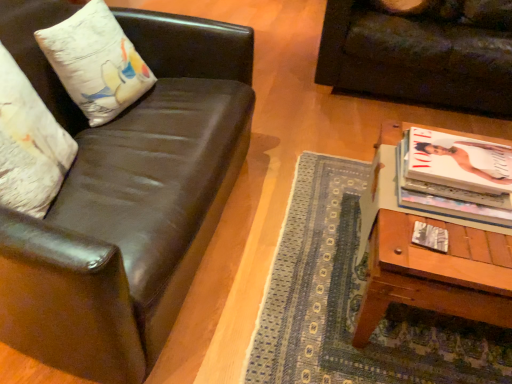
What are the coordinates of `vacant area to the right of matte white magazine at right` in the screenshot? It's located at (474, 246).